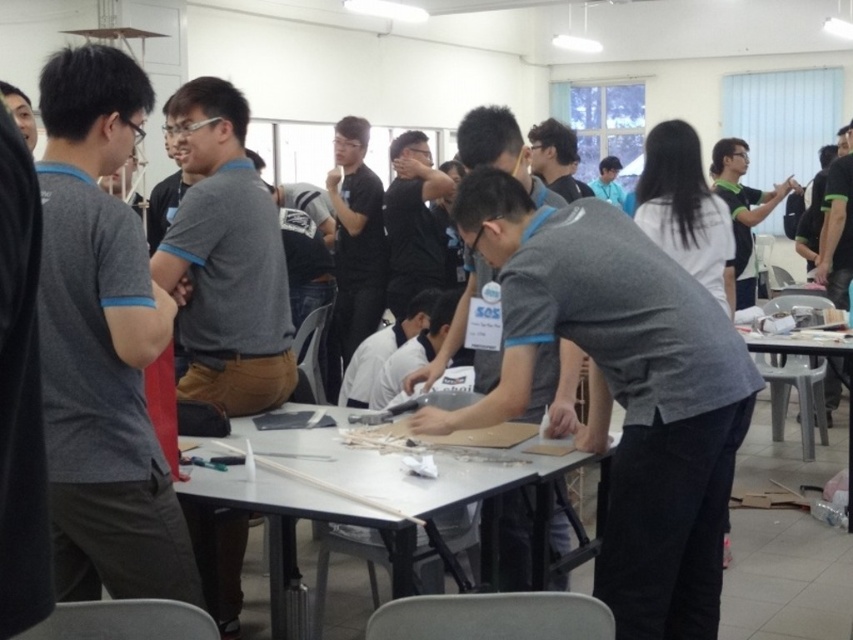
Based on the photo, can you confirm if gray matte shirt at center is positioned below clear plastic table at right?

Yes.

Which is above, gray matte shirt at center or clear plastic table at right?

clear plastic table at right

This screenshot has width=853, height=640. In order to click on gray matte shirt at center in this screenshot , I will do [621, 390].

Is point (614, 385) in front of point (491, 451)?

Yes, point (614, 385) is in front of point (491, 451).

What do you see at coordinates (621, 390) in the screenshot?
I see `gray matte shirt at center` at bounding box center [621, 390].

What are the coordinates of `gray matte shirt at center` in the screenshot? It's located at (621, 390).

Is point (271, 572) more distant than point (799, 413)?

No, (271, 572) is in front of (799, 413).

Does white plastic table at center have a greater height compared to clear plastic table at right?

Yes, white plastic table at center is taller than clear plastic table at right.

Does point (538, 513) come in front of point (804, 404)?

Yes, point (538, 513) is in front of point (804, 404).

This screenshot has width=853, height=640. In order to click on white plastic table at center in this screenshot , I will do `click(415, 477)`.